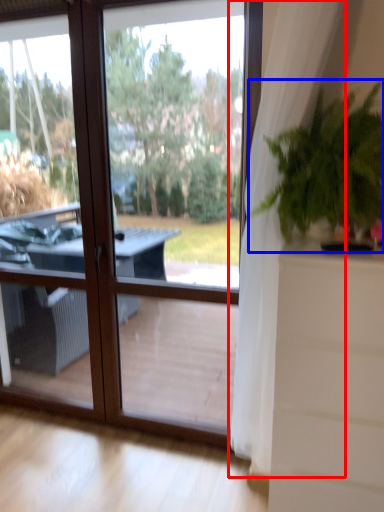
Question: Which object is further to the camera taking this photo, curtain (highlighted by a red box) or houseplant (highlighted by a blue box)?

Choices:
 (A) curtain
 (B) houseplant

Answer: (B)